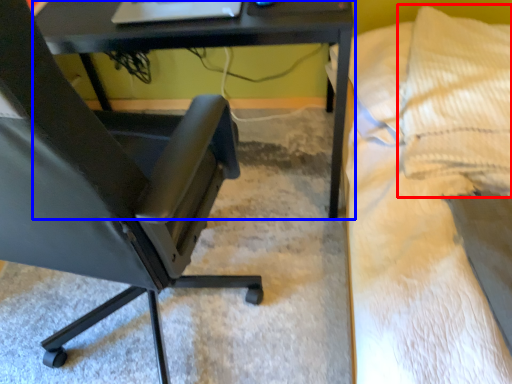
Question: Which object appears closest to the camera in this image, pillow (highlighted by a red box) or table (highlighted by a blue box)?

Choices:
 (A) pillow
 (B) table

Answer: (B)